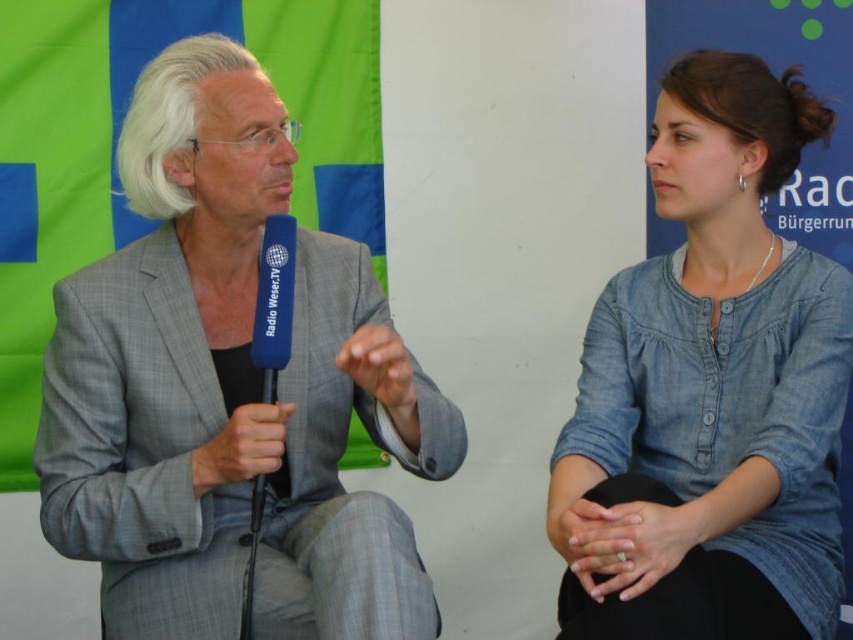
Question: Considering the relative positions of gray textured suit at left and denim shirt at center in the image provided, where is gray textured suit at left located with respect to denim shirt at center?

Choices:
 (A) right
 (B) left

Answer: (B)

Question: Which point is closer to the camera?

Choices:
 (A) (341, 250)
 (B) (248, 609)
 (C) (688, 268)

Answer: (B)

Question: Among these points, which one is nearest to the camera?

Choices:
 (A) (292, 250)
 (B) (838, 268)
 (C) (50, 349)

Answer: (A)

Question: Which of the following is the farthest from the observer?

Choices:
 (A) (827, 600)
 (B) (421, 433)

Answer: (A)

Question: From the image, what is the correct spatial relationship of gray textured suit at left in relation to denim shirt at center?

Choices:
 (A) left
 (B) right

Answer: (A)

Question: Can you confirm if gray textured suit at left is wider than denim shirt at center?

Choices:
 (A) yes
 (B) no

Answer: (A)